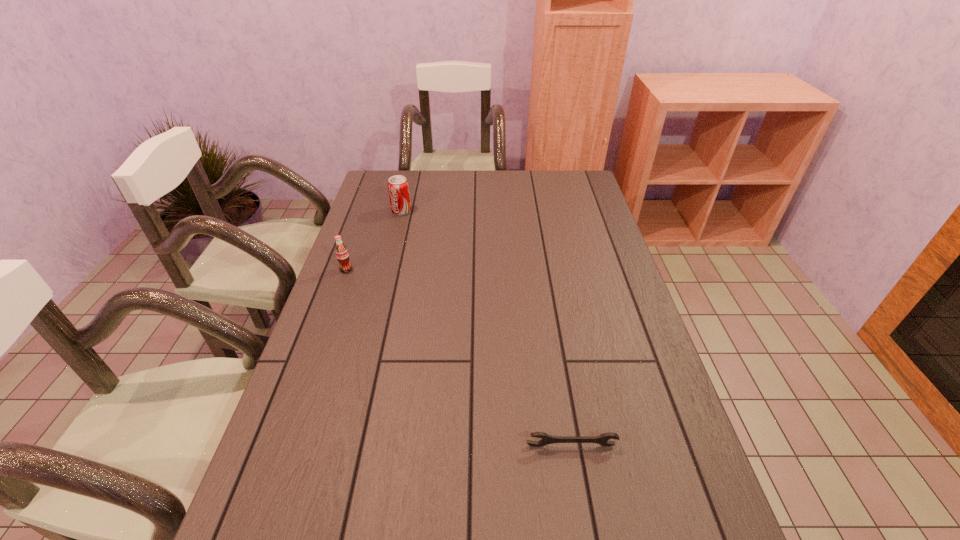
Where is `the farther soda`? The height and width of the screenshot is (540, 960). the farther soda is located at coordinates (398, 188).

Where is `the second object from left to right`? This screenshot has width=960, height=540. the second object from left to right is located at coordinates (398, 188).

You are a GUI agent. You are given a task and a screenshot of the screen. Output one action in this format:
    pyautogui.click(x=<x>, y=<y>)
    Task: Click on the left soda
    Image resolution: width=960 pixels, height=540 pixels.
    Given the screenshot: What is the action you would take?
    pyautogui.click(x=342, y=255)

Where is `the nearer soda`? the nearer soda is located at coordinates (342, 255).

Find the location of a particular element. the nearest object is located at coordinates (603, 439).

Locate an element on the screen. the shortest object is located at coordinates (603, 439).

Image resolution: width=960 pixels, height=540 pixels. What are the coordinates of `vacant space situated on the left of the farther soda` in the screenshot? It's located at (362, 211).

At what (x,y) coordinates should I click in order to perform the action: click on vacant area situated 0.320m on the back of the leftmost object. Please return your answer as a coordinate pair (x, y). Image resolution: width=960 pixels, height=540 pixels. Looking at the image, I should click on (367, 210).

Where is `free space located 0.050m on the open ends of the wrench`? free space located 0.050m on the open ends of the wrench is located at coordinates (576, 470).

Where is `object positioned at the right edge`? Image resolution: width=960 pixels, height=540 pixels. object positioned at the right edge is located at coordinates click(x=603, y=439).